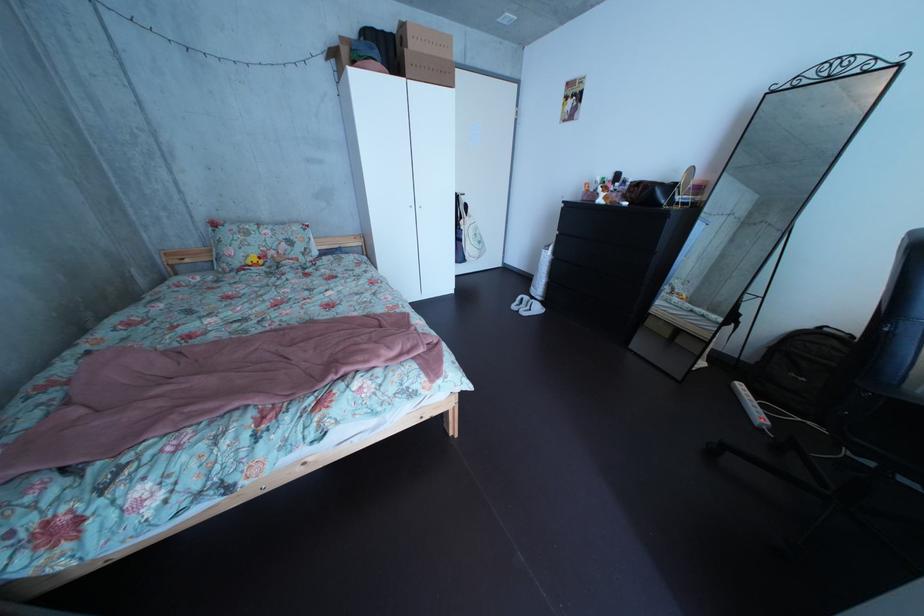
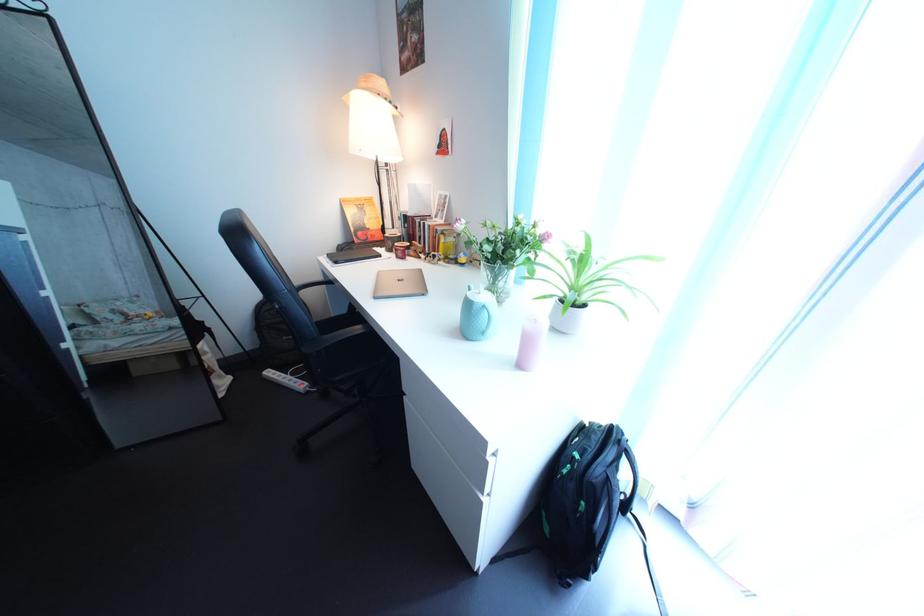
The point at (755,394) is marked in the first image. Where is the corresponding point in the second image?

(284, 381)